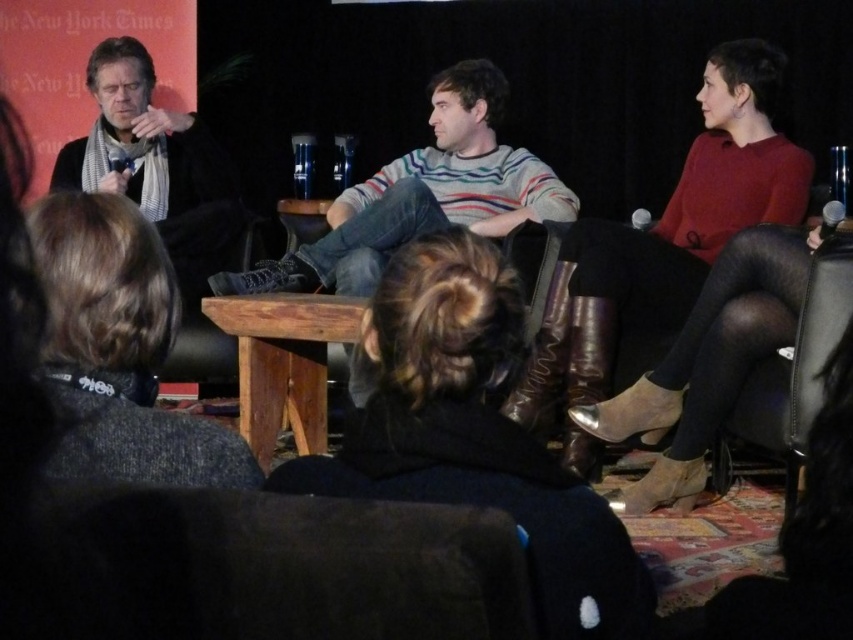
Question: Is leather boots at center thinner than wooden table at center?

Choices:
 (A) yes
 (B) no

Answer: (A)

Question: Which point appears farthest from the camera in this image?

Choices:
 (A) (518, 312)
 (B) (788, 488)
 (C) (779, 289)

Answer: (C)

Question: Can you confirm if leather boots at center is positioned to the left of matte black scarf at left?

Choices:
 (A) yes
 (B) no

Answer: (B)

Question: Which point is closer to the camera?

Choices:
 (A) leather boots at center
 (B) black leather chair at right
 (C) matte black boots at right

Answer: (A)

Question: Which point is closer to the camera?

Choices:
 (A) black leather chair at right
 (B) striped sweater at center
 (C) leather boots at center
 (D) dark brown hair at lower left

Answer: (D)

Question: Can you confirm if dark brown hair at lower left is bigger than wooden table at center?

Choices:
 (A) yes
 (B) no

Answer: (B)